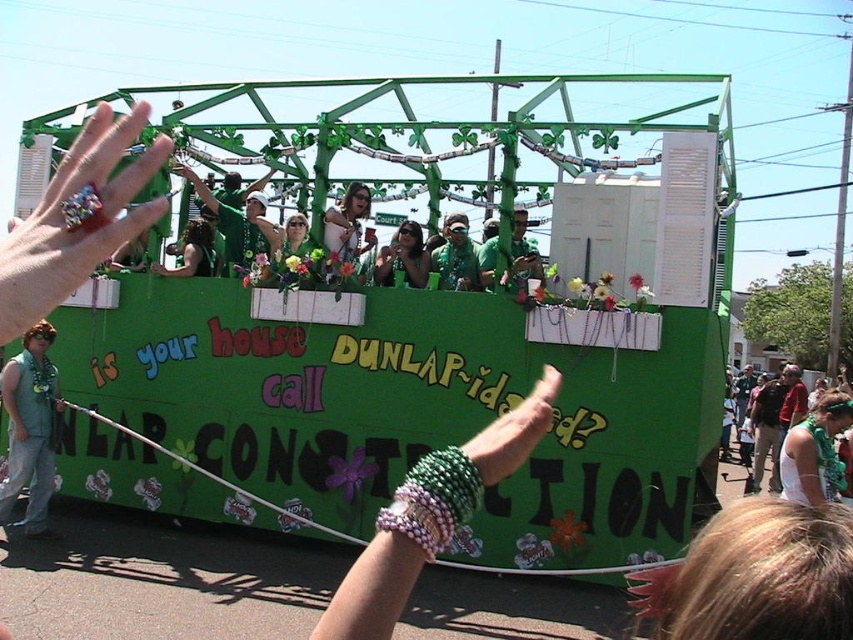
You are a photographer standing at the camera position. You want to take a picture of the shiny silver sunglasses at center. Can you fit both the sunglasses and the camera in the frame without moving either? Explain your reasoning.

The shiny silver sunglasses at center and the camera are 7.85 meters apart from each other. Since the distance between them is significant, it might be challenging to fit both in the same frame without moving either. However, using a wide angle lens could potentially capture both objects if the camera is positioned appropriately. Alternatively, adjusting the zoom might help, but the exact feasibility depends on the camera settings and lens capabilities.

You are a photographer trying to capture a clear shot of the shiny silver sunglasses at center and the green fabric headband at upper right. Which object should you focus on first if you want to ensure both are in the frame without moving the camera?

The green fabric headband at upper right is positioned on the right side of the shiny silver sunglasses at center, so you should focus on the shiny silver sunglasses at center first to ensure both are in the frame without moving the camera.

You are a photographer at the parade and want to capture both the shiny green shirt at center and the green fabric shirt at center in your shot. Which shirt is positioned lower in the image?

The shiny green shirt at center is positioned lower than the green fabric shirt at center.